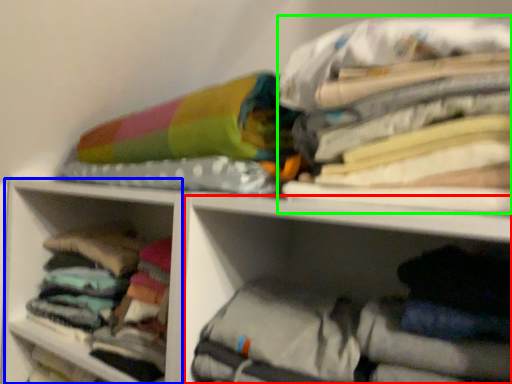
Question: Which object is the farthest from cabinet (highlighted by a red box)? Choose among these: cabinet (highlighted by a blue box) or clothing (highlighted by a green box).

Choices:
 (A) cabinet
 (B) clothing

Answer: (A)